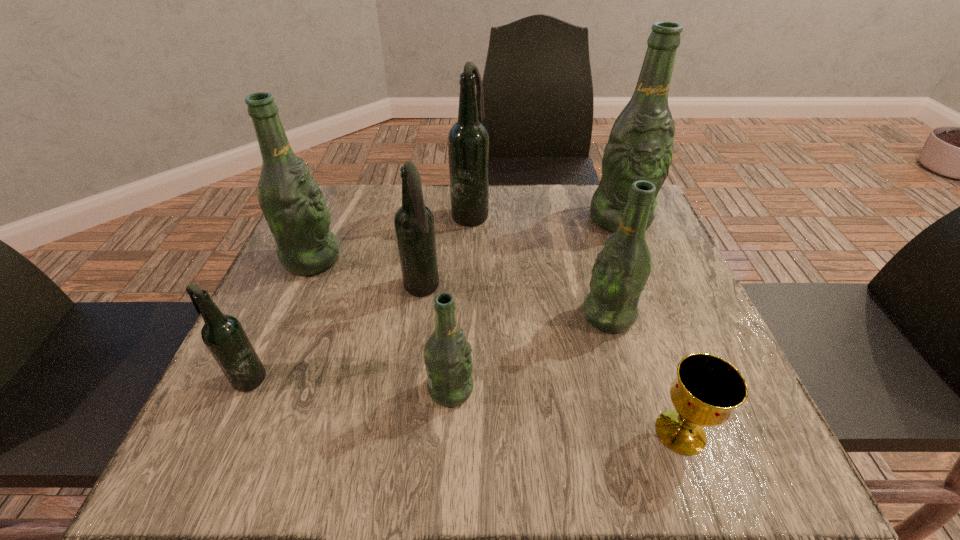
Locate an element on the screen. This screenshot has width=960, height=540. free space located on the surface of the second nearest green beer bottle is located at coordinates (528, 316).

Where is `free space located 0.170m on the back of the second smallest dark beer bottle`? Image resolution: width=960 pixels, height=540 pixels. free space located 0.170m on the back of the second smallest dark beer bottle is located at coordinates (430, 228).

Where is `vacant space located 0.130m on the front of the leftmost dark beer bottle`? Image resolution: width=960 pixels, height=540 pixels. vacant space located 0.130m on the front of the leftmost dark beer bottle is located at coordinates (205, 469).

At what (x,y) coordinates should I click in order to perform the action: click on vacant space located 0.120m on the surface of the smallest green beer bottle. Please return your answer as a coordinate pair (x, y). Looking at the image, I should click on (543, 389).

Locate an element on the screen. The width and height of the screenshot is (960, 540). vacant area situated 0.270m on the back of the gold chalice is located at coordinates (632, 293).

Where is `object situated at the near edge`? Image resolution: width=960 pixels, height=540 pixels. object situated at the near edge is located at coordinates (707, 389).

You are a GUI agent. You are given a task and a screenshot of the screen. Output one action in this format:
    pyautogui.click(x=<x>, y=<y>)
    Task: Click on the chalice that is positioned at the right edge
    
    Given the screenshot: What is the action you would take?
    pyautogui.click(x=707, y=389)

Image resolution: width=960 pixels, height=540 pixels. Find the location of `object that is at the far right corner`. object that is at the far right corner is located at coordinates (640, 147).

Find the location of `object located in the near right corner section of the desktop`. object located in the near right corner section of the desktop is located at coordinates (707, 389).

At what (x,y) coordinates should I click in order to perform the action: click on free space at the far edge of the desktop. Please return your answer as a coordinate pair (x, y). Looking at the image, I should click on (549, 186).